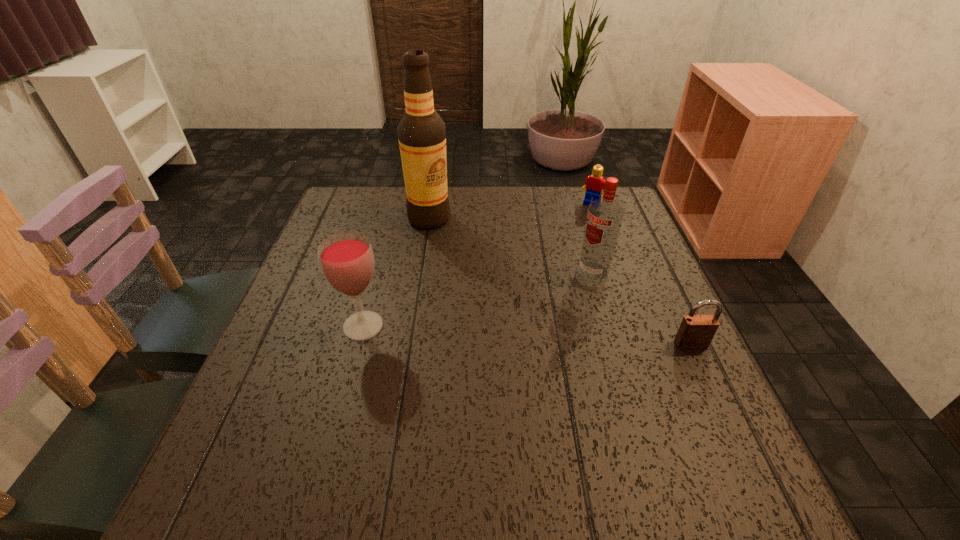
Identify the location of object that stands as the third closest to the Lego. Image resolution: width=960 pixels, height=540 pixels. (696, 331).

The height and width of the screenshot is (540, 960). I want to click on free space that satisfies the following two spatial constraints: 1. on the back side of the tallest object; 2. on the left side of the Lego, so click(x=432, y=204).